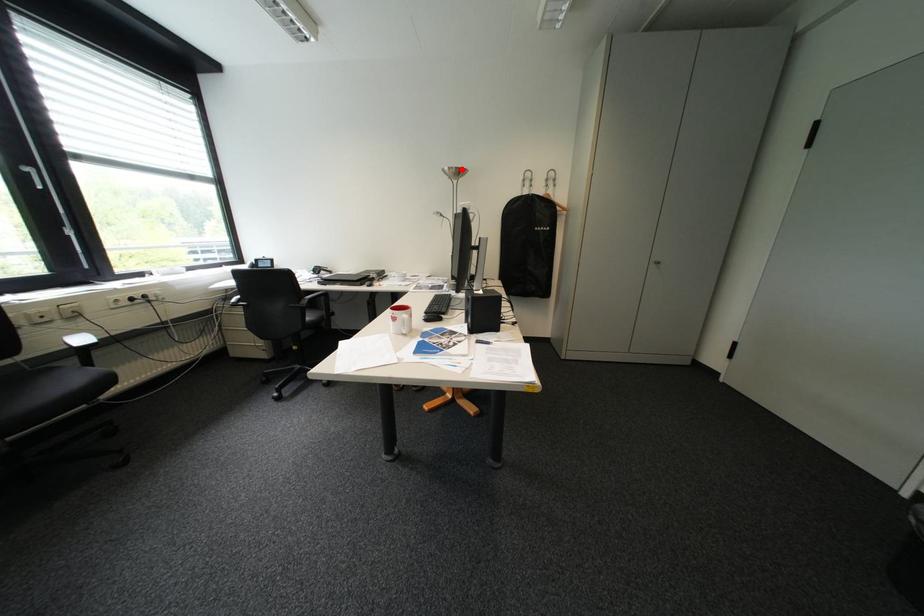
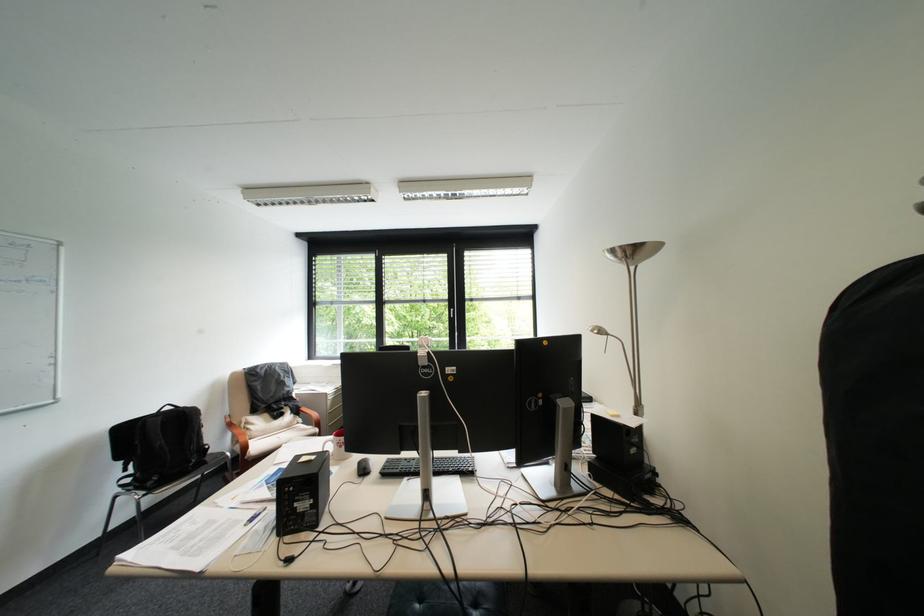
In the second image, find the point that corresponds to the highlighted location in the first image.

(625, 252)